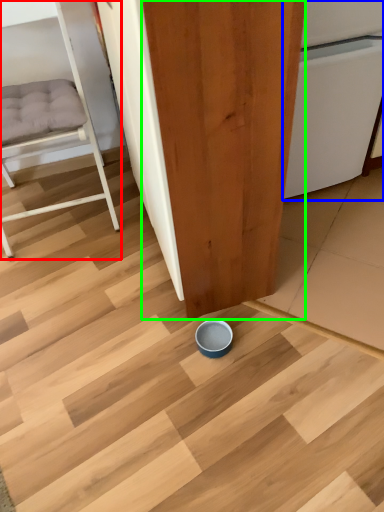
Question: Which is nearer to the furniture (highlighted by a red box)? dish washer (highlighted by a blue box) or plywood (highlighted by a green box).

Choices:
 (A) dish washer
 (B) plywood

Answer: (B)